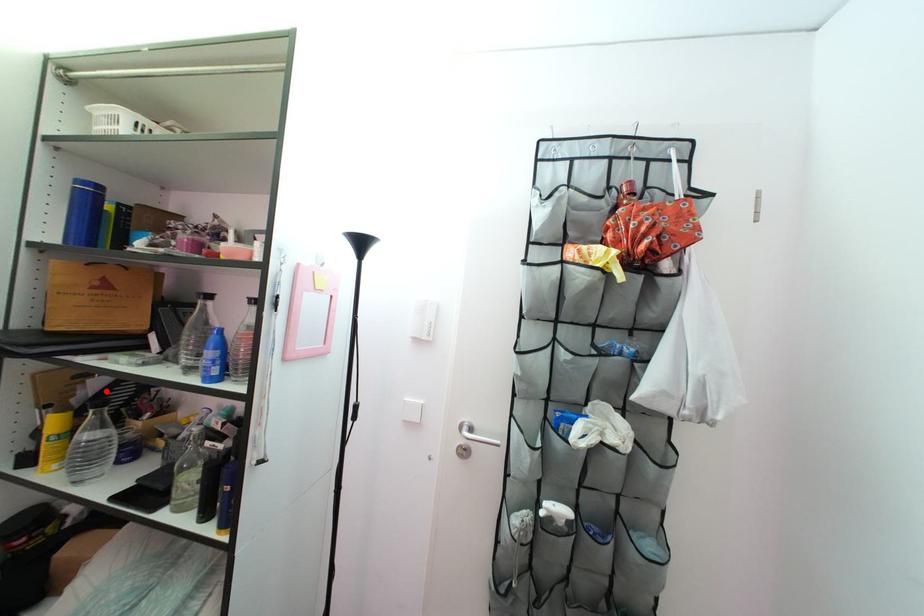
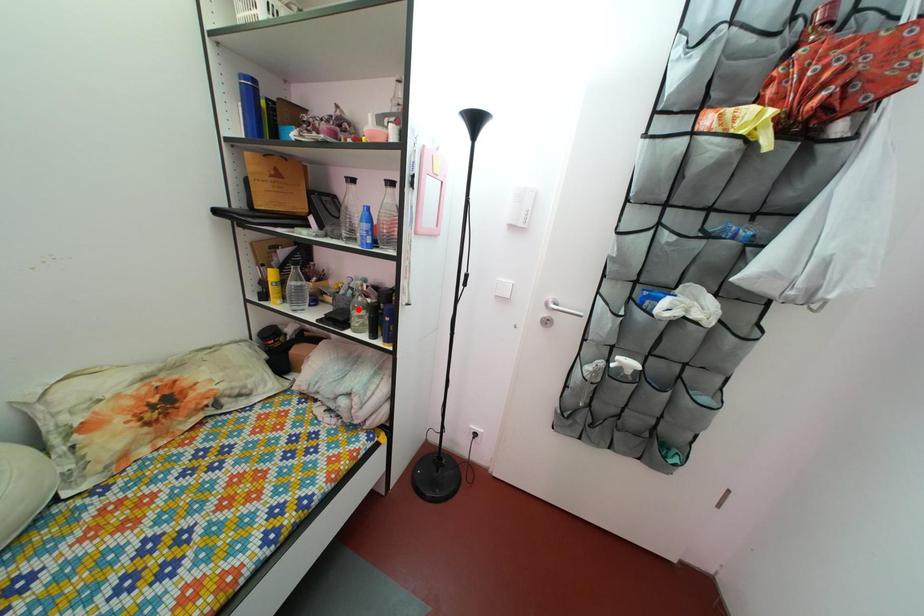
I am providing you with two images of the same scene from different viewpoints. A red point is marked on the first image and another point is marked on the second image. Is the red point in image1 aligned with the point shown in image2?

No